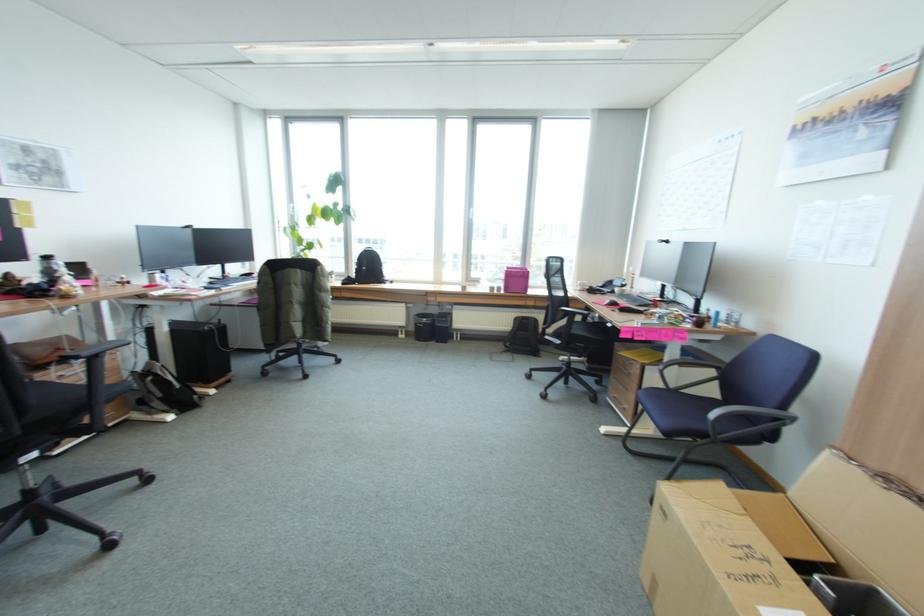
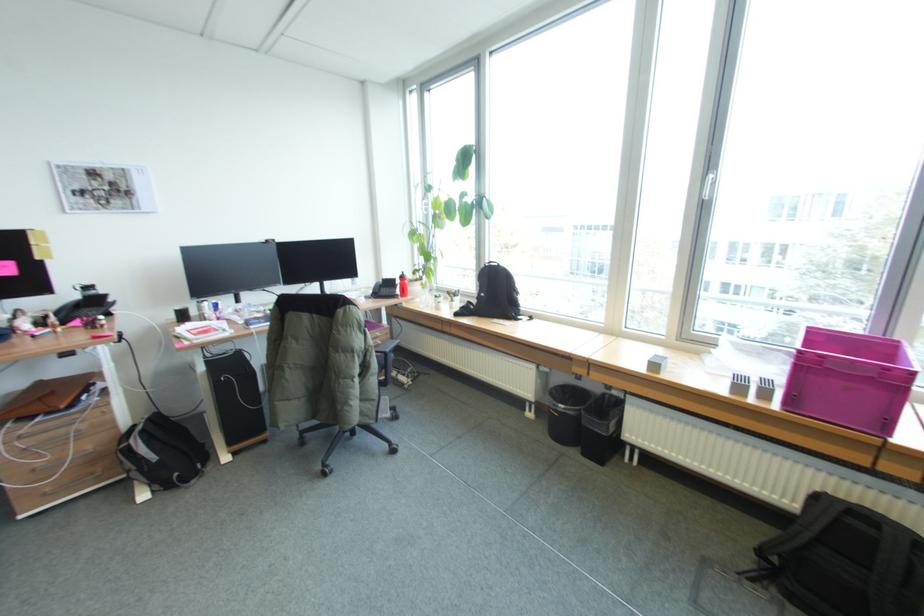
In the second image, find the point that corresponds to point 511,270 in the first image.

(803, 350)